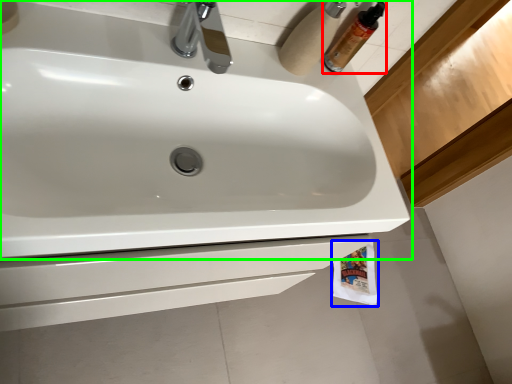
Question: Which is nearer to the mouthwash (highlighted by a red box)? toilet paper (highlighted by a blue box) or sink (highlighted by a green box).

Choices:
 (A) toilet paper
 (B) sink

Answer: (B)